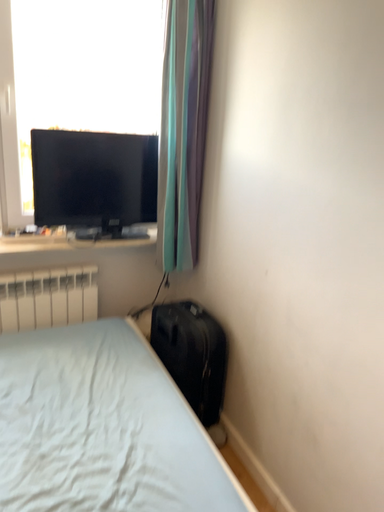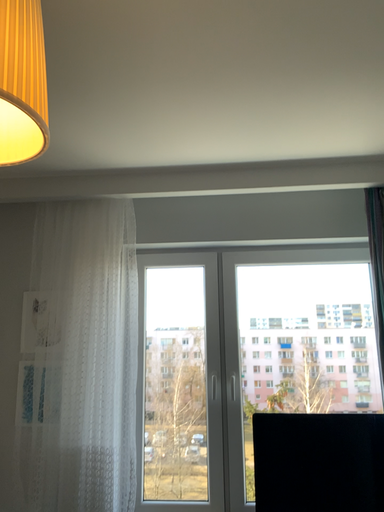
Question: Which way did the camera rotate in the video?

Choices:
 (A) rotated upward
 (B) rotated downward

Answer: (A)